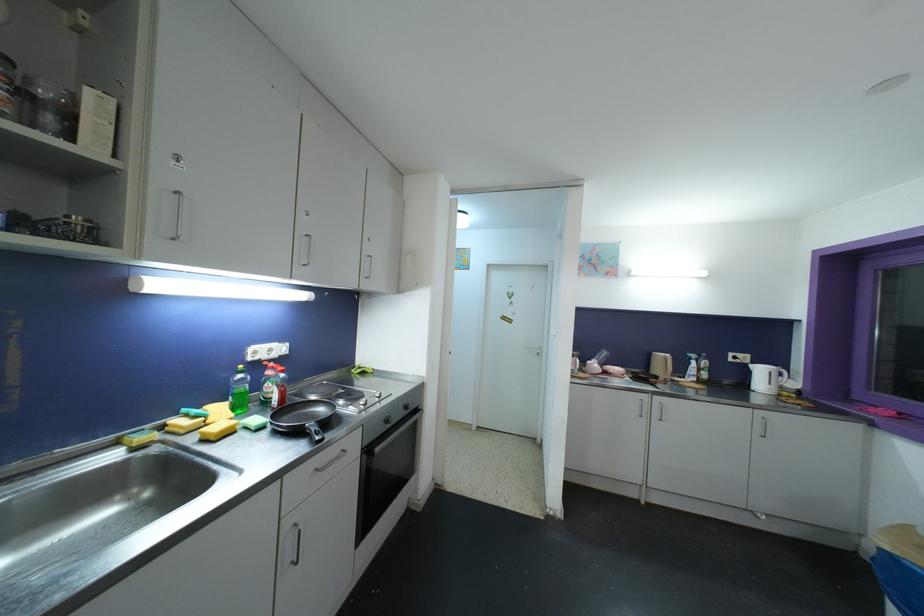
Describe the element at coordinates (280, 387) in the screenshot. I see `the red-cap bottle` at that location.